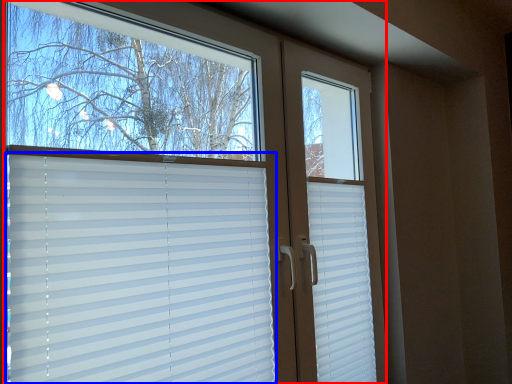
Question: Which object is further to the camera taking this photo, window (highlighted by a red box) or window blind (highlighted by a blue box)?

Choices:
 (A) window
 (B) window blind

Answer: (B)